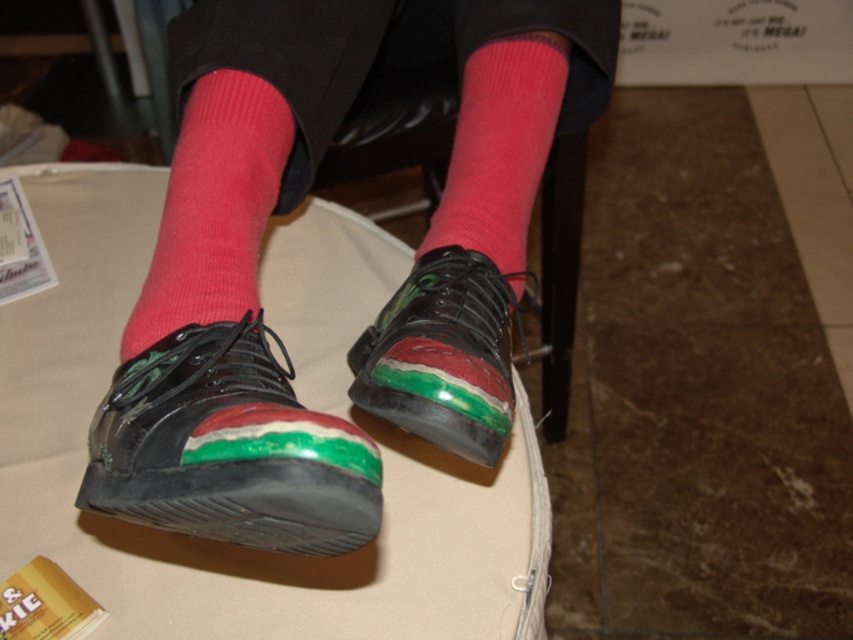
Question: Which object is positioned closest to the pink woolen sock at center?

Choices:
 (A) green matte shoe at center
 (B) pink ribbed socks at center

Answer: (A)

Question: Which object appears farthest from the camera in this image?

Choices:
 (A) pink woolen sock at center
 (B) pink ribbed sock at lower left
 (C) pink ribbed socks at center

Answer: (A)

Question: Can you confirm if pink ribbed socks at center is smaller than green matte shoe at center?

Choices:
 (A) yes
 (B) no

Answer: (B)

Question: Does pink ribbed socks at center appear over green matte shoe at center?

Choices:
 (A) no
 (B) yes

Answer: (B)

Question: Which object appears closest to the camera in this image?

Choices:
 (A) pink ribbed socks at center
 (B) shiny black shoe at lower center
 (C) pink woolen sock at center

Answer: (B)

Question: Observing the image, what is the correct spatial positioning of shiny black shoe at lower center in reference to green matte shoe at center?

Choices:
 (A) above
 (B) below

Answer: (B)